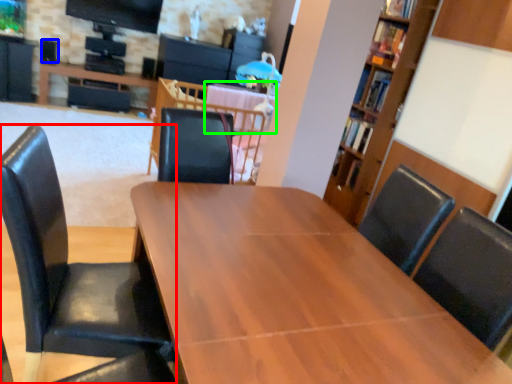
Question: Which object is the closest to the chair (highlighted by a red box)? Choose among these: speaker (highlighted by a blue box) or table (highlighted by a green box).

Choices:
 (A) speaker
 (B) table

Answer: (B)